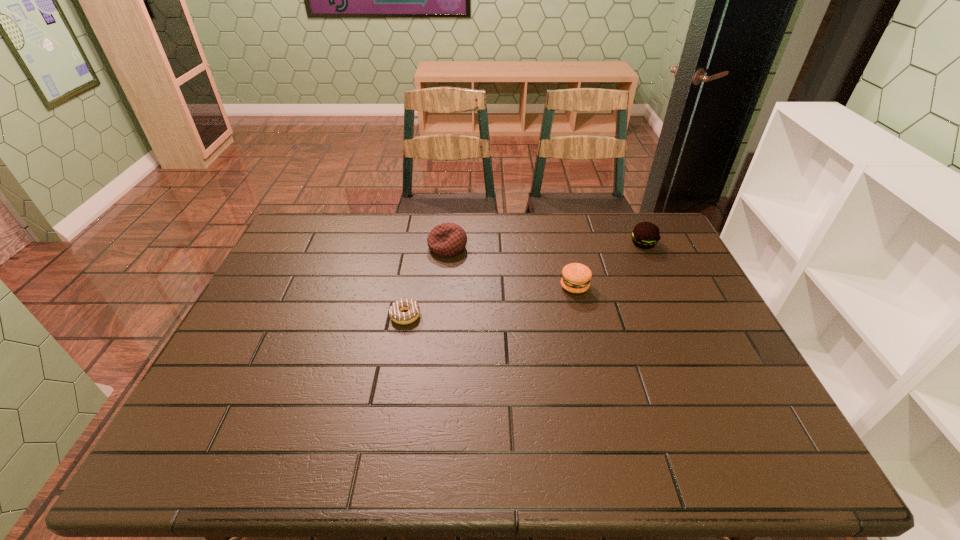
Image resolution: width=960 pixels, height=540 pixels. What are the coordinates of `free space at the far right corner` in the screenshot? It's located at (632, 231).

Where is `free area in between the farther patty and the doughnut`? free area in between the farther patty and the doughnut is located at coordinates pyautogui.click(x=524, y=280).

Where is `vacant point located between the beanbag and the farther patty`? vacant point located between the beanbag and the farther patty is located at coordinates (545, 246).

At what (x,y) coordinates should I click in order to perform the action: click on free spot between the left patty and the right patty. Please return your answer as a coordinate pair (x, y). The height and width of the screenshot is (540, 960). Looking at the image, I should click on (609, 265).

Locate an element on the screen. This screenshot has width=960, height=540. vacant space that's between the second nearest object and the beanbag is located at coordinates (511, 267).

Find the location of `blank region between the nearer patty and the right patty`. blank region between the nearer patty and the right patty is located at coordinates (609, 265).

Identify the location of free space between the second nearest object and the farther patty. The image size is (960, 540). (609, 265).

Locate an element on the screen. Image resolution: width=960 pixels, height=540 pixels. free spot between the beanbag and the farther patty is located at coordinates coord(545,246).

I want to click on vacant area between the doughnut and the farther patty, so click(524, 280).

You are a GUI agent. You are given a task and a screenshot of the screen. Output one action in this format:
    pyautogui.click(x=<x>, y=<y>)
    Task: Click on the vacant space that's between the farther patty and the left patty
    The image size is (960, 540).
    Given the screenshot: What is the action you would take?
    pyautogui.click(x=609, y=265)